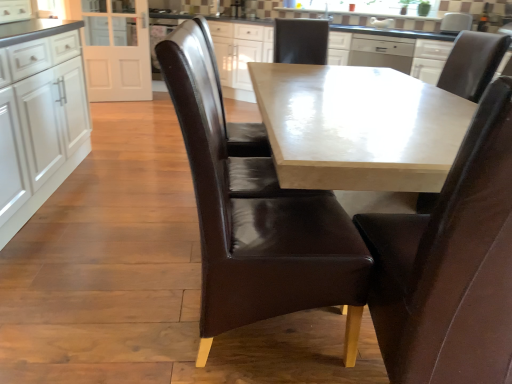
This screenshot has width=512, height=384. I want to click on vacant space situated on the left part of brown leather chair at center, acting as the 3th chair starting from the right, so click(x=124, y=317).